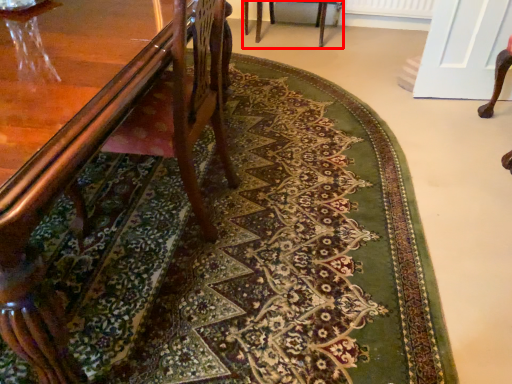
Question: From the image's perspective, where is chair (annotated by the red box) located relative to chair?

Choices:
 (A) below
 (B) above

Answer: (B)